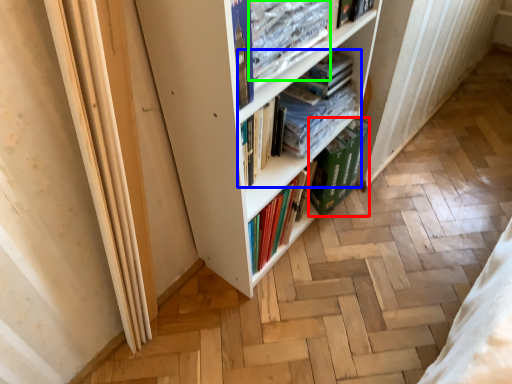
Question: Which object is positioned closest to paperback book (highlighted by a red box)? Select from book (highlighted by a blue box) and book (highlighted by a green box).

Choices:
 (A) book
 (B) book

Answer: (A)